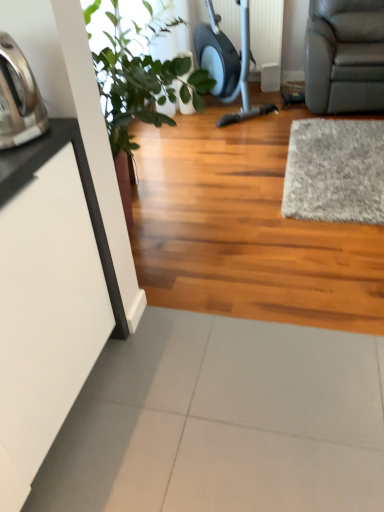
Question: Is green leafy plant at upper left inside brushed metal kettle at left?

Choices:
 (A) no
 (B) yes

Answer: (A)

Question: Does brushed metal kettle at left have a smaller size compared to green leafy plant at upper left?

Choices:
 (A) yes
 (B) no

Answer: (A)

Question: Considering the relative sizes of brushed metal kettle at left and green leafy plant at upper left in the image provided, is brushed metal kettle at left thinner than green leafy plant at upper left?

Choices:
 (A) yes
 (B) no

Answer: (A)

Question: Is brushed metal kettle at left positioned with its back to green leafy plant at upper left?

Choices:
 (A) no
 (B) yes

Answer: (A)

Question: Is brushed metal kettle at left wider than green leafy plant at upper left?

Choices:
 (A) yes
 (B) no

Answer: (B)

Question: From the image's perspective, does brushed metal kettle at left appear higher than green leafy plant at upper left?

Choices:
 (A) no
 (B) yes

Answer: (A)

Question: From a real-world perspective, does brushed metal kettle at left sit lower than gray shaggy rug at right?

Choices:
 (A) no
 (B) yes

Answer: (A)

Question: Is brushed metal kettle at left in front of gray shaggy rug at right?

Choices:
 (A) no
 (B) yes

Answer: (B)

Question: Is brushed metal kettle at left thinner than gray shaggy rug at right?

Choices:
 (A) yes
 (B) no

Answer: (A)

Question: Is brushed metal kettle at left bigger than gray shaggy rug at right?

Choices:
 (A) no
 (B) yes

Answer: (A)

Question: Does brushed metal kettle at left appear on the left side of gray shaggy rug at right?

Choices:
 (A) no
 (B) yes

Answer: (B)

Question: Is brushed metal kettle at left further to camera compared to gray shaggy rug at right?

Choices:
 (A) no
 (B) yes

Answer: (A)

Question: Considering the relative sizes of green leafy plant at upper left and brushed metal kettle at left in the image provided, is green leafy plant at upper left thinner than brushed metal kettle at left?

Choices:
 (A) yes
 (B) no

Answer: (B)